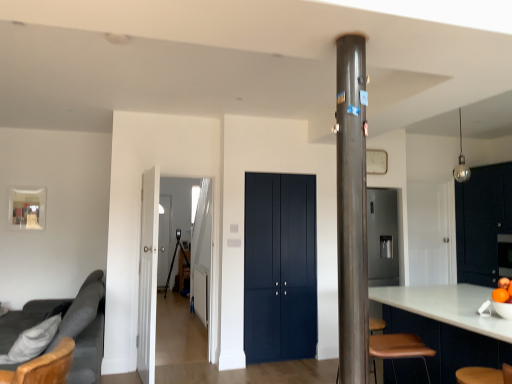
What is the approximate height of matte dark blue cabinet at center, the first door when ordered from right to left?

matte dark blue cabinet at center, the first door when ordered from right to left, is 6.55 feet in height.

Looking at this image, in order to face transparent glass door at center, which is the 2th glass door in front-to-back order, should I rotate leftwards or rightwards?

Rotate your view left by about 12.503°.

At what (x,y) coordinates should I click in order to perform the action: click on white glossy cabinetry at lower right. Please return your answer as a coordinate pair (x, y). The image size is (512, 384). Looking at the image, I should click on (448, 325).

The image size is (512, 384). Identify the location of transparent glass door at center, placed as the 1th glass door when sorted from front to back. (148, 275).

Visually, is white wooden door at left, positioned as the 1th door in front-to-back order, positioned to the left or to the right of dark gray fabric couch at left?

Based on their positions, white wooden door at left, positioned as the 1th door in front-to-back order, is located to the right of dark gray fabric couch at left.

Considering the sizes of objects white wooden door at left, placed as the 2th door when sorted from back to front, and dark gray fabric couch at left in the image provided, who is bigger, white wooden door at left, placed as the 2th door when sorted from back to front, or dark gray fabric couch at left?

dark gray fabric couch at left is bigger.

In order to click on studio couch below the white wooden door at left, placed as the 2th door when sorted from back to front (from the image's perspective) in this screenshot , I will do `click(76, 334)`.

Are transparent glass door at center, which is counted as the 2th glass door, starting from the back, and transparent glass door at center, which ranks as the 2th glass door in right-to-left order, located far from each other?

Yes, transparent glass door at center, which is counted as the 2th glass door, starting from the back, is far from transparent glass door at center, which ranks as the 2th glass door in right-to-left order.

Would you say transparent glass door at center, which is the second glass door in left-to-right order, is inside or outside transparent glass door at center, which ranks as the 2th glass door in right-to-left order?

The correct answer is: outside.

Find the location of a particular element. This screenshot has height=384, width=512. glass door on the right of transparent glass door at center, which ranks as the 2th glass door in right-to-left order is located at coordinates (148, 275).

Is metallic gray pole at center with transparent glass door at center, which ranks as the first glass door in left-to-right order?

metallic gray pole at center is not next to transparent glass door at center, which ranks as the first glass door in left-to-right order, and they're not touching.

Which is behind, point (365, 292) or point (160, 270)?

The point (160, 270) is more distant.

Is transparent glass door at center, which ranks as the first glass door in left-to-right order, surrounded by metallic gray pole at center?

Actually, transparent glass door at center, which ranks as the first glass door in left-to-right order, is outside metallic gray pole at center.

Is metallic gray pole at center at the right side of transparent glass door at center, which is the 2th glass door in front-to-back order?

Indeed, metallic gray pole at center is positioned on the right side of transparent glass door at center, which is the 2th glass door in front-to-back order.

From a real-world perspective, is transparent glass door at center, which is the second glass door in left-to-right order, physically below metallic gray pole at center?

Indeed, from a real-world perspective, transparent glass door at center, which is the second glass door in left-to-right order, is positioned beneath metallic gray pole at center.

Is point (142, 223) closer or farther from the camera than point (348, 341)?

Point (142, 223) appears to be farther away from the viewer than point (348, 341).

From the image's perspective, is transparent glass door at center, which appears as the 1th glass door when viewed from the right, under metallic gray pole at center?

Indeed, from the image's perspective, transparent glass door at center, which appears as the 1th glass door when viewed from the right, is shown beneath metallic gray pole at center.

Is transparent glass door at center, which is counted as the 2th glass door, starting from the back, inside the boundaries of metallic gray pole at center, or outside?

transparent glass door at center, which is counted as the 2th glass door, starting from the back, is outside metallic gray pole at center.

Is dark gray fabric couch at left touching shiny black dresser at right?

No, dark gray fabric couch at left is not next to shiny black dresser at right.

Is shiny black dresser at right at the back of dark gray fabric couch at left?

Absolutely, dark gray fabric couch at left is directed away from shiny black dresser at right.

Considering the relative sizes of dark gray fabric couch at left and shiny black dresser at right in the image provided, is dark gray fabric couch at left wider than shiny black dresser at right?

Yes.

Is dark gray fabric couch at left closer to camera compared to shiny black dresser at right?

Yes, it is in front of shiny black dresser at right.

Is dark gray fabric couch at left bigger or smaller than white wooden door at left, which ranks as the 2th door in right-to-left order?

Considering their sizes, dark gray fabric couch at left takes up more space than white wooden door at left, which ranks as the 2th door in right-to-left order.

In terms of width, does dark gray fabric couch at left look wider or thinner when compared to white wooden door at left, which is the first door from left to right?

Clearly, dark gray fabric couch at left has more width compared to white wooden door at left, which is the first door from left to right.

Considering the points (87, 285) and (139, 317), which point is in front, point (87, 285) or point (139, 317)?

The point (87, 285) is in front.

Can you tell me how much dark gray fabric couch at left and white wooden door at left, placed as the 2th door when sorted from back to front, differ in facing direction?

They differ by 174 degrees in their facing directions.

Which object is closer to the camera, metallic gray pole at center or transparent glass door at center, which is counted as the 2th glass door, starting from the back?

metallic gray pole at center is in front.

Locate an element on the screen. the 1st glass door to the left of the metallic gray pole at center, starting your count from the anchor is located at coordinates (148, 275).

The height and width of the screenshot is (384, 512). In the image, there is a white wooden door at left, placed as the 2th door when sorted from back to front. In order to click on studio couch below it (from the image's perspective) in this screenshot , I will do `click(76, 334)`.

You are a GUI agent. You are given a task and a screenshot of the screen. Output one action in this format:
    pyautogui.click(x=<x>, y=<y>)
    Task: Click on the glass door behind the transparent glass door at center, placed as the 1th glass door when sorted from front to back
    Image resolution: width=512 pixels, height=384 pixels.
    Given the screenshot: What is the action you would take?
    pyautogui.click(x=164, y=241)

Consider the image. Looking at the image, which one is located closer to dark gray fabric couch at left, matte dark blue cabinet at center, the first door when ordered from right to left, or transparent glass door at center, which is counted as the 2th glass door, starting from the back?

transparent glass door at center, which is counted as the 2th glass door, starting from the back, is positioned closer to the anchor dark gray fabric couch at left.

Considering their positions, is transparent glass door at center, which ranks as the 2th glass door in right-to-left order, positioned closer to white wooden door at left, which ranks as the 2th door in right-to-left order, than matte dark blue cabinet at center, which is the 2th door from left to right?

matte dark blue cabinet at center, which is the 2th door from left to right, lies closer to white wooden door at left, which ranks as the 2th door in right-to-left order, than the other object.

Considering their positions, is metallic gray pole at center positioned closer to matte dark blue cabinet at center, the first door when ordered from back to front, than transparent glass door at center, the first glass door viewed from the back?

Among the two, metallic gray pole at center is located nearer to matte dark blue cabinet at center, the first door when ordered from back to front.

Looking at the image, which one is located closer to shiny black dresser at right, white glossy cabinetry at lower right or transparent glass door at center, which is the 2th glass door in front-to-back order?

Among the two, white glossy cabinetry at lower right is located nearer to shiny black dresser at right.

Considering their positions, is matte dark blue cabinet at center, which is the 2th door from left to right, positioned further to dark gray fabric couch at left than transparent glass door at center, which is the 2th glass door in front-to-back order?

The object further to dark gray fabric couch at left is transparent glass door at center, which is the 2th glass door in front-to-back order.

Looking at the image, which one is located further to dark gray fabric couch at left, transparent glass door at center, placed as the 1th glass door when sorted from front to back, or white glossy cabinetry at lower right?

white glossy cabinetry at lower right is positioned further to the anchor dark gray fabric couch at left.

Based on their spatial positions, is white glossy cabinetry at lower right or transparent glass door at center, which is the second glass door in left-to-right order, further from dark gray fabric couch at left?

The object further to dark gray fabric couch at left is white glossy cabinetry at lower right.

When comparing their distances from metallic gray pole at center, does dark gray fabric couch at left or white glossy cabinetry at lower right seem further?

dark gray fabric couch at left.

Identify the location of glass door between dark gray fabric couch at left and matte dark blue cabinet at center, which is the 2th door from left to right, in the front-back direction. (148, 275).

Locate an element on the screen. The height and width of the screenshot is (384, 512). studio couch positioned between metallic gray pole at center and transparent glass door at center, which appears as the 1th glass door when viewed from the right, from near to far is located at coordinates (76, 334).

This screenshot has height=384, width=512. Identify the location of dresser located between transparent glass door at center, which is the second glass door in left-to-right order, and transparent glass door at center, which ranks as the first glass door in left-to-right order, in the depth direction. (482, 222).

Identify the location of cabinetry between transparent glass door at center, which is counted as the 2th glass door, starting from the back, and shiny black dresser at right. (448, 325).